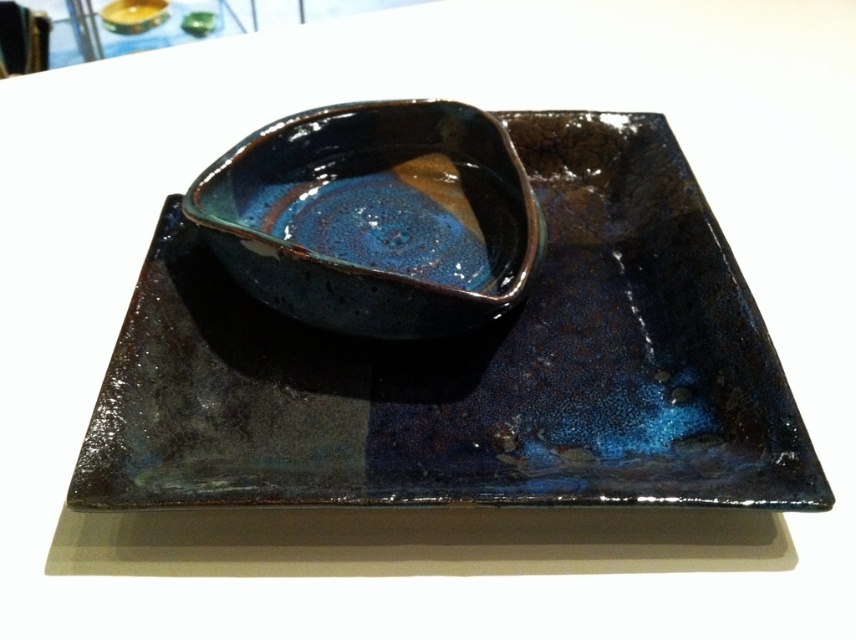
You are setting up a dining table and have both the glossy ceramic tray at center and the glossy ceramic bowl at center. Which one would you use to serve a main course like a pasta dish?

The glossy ceramic tray at center is larger in size than the glossy ceramic bowl at center, so it would be more suitable for serving a main course like a pasta dish.

You are arranging a dinner set and need to place the glossy ceramic tray at center and the glossy ceramic bowl at center on a table. According to the image, which one should be placed to the left to maintain the original arrangement?

The glossy ceramic bowl at center should be placed to the left because the glossy ceramic tray at center is to the right of it in the original arrangement.

You are standing at the camera position and want to reach the glossy ceramic tray at center to adjust its position. Considering your arm length is 0.7 meters, can you reach it without moving your feet?

The glossy ceramic tray at center is 1.10 meters away from the camera. Since your arm length is 0.7 meters, you cannot reach it without moving your feet.